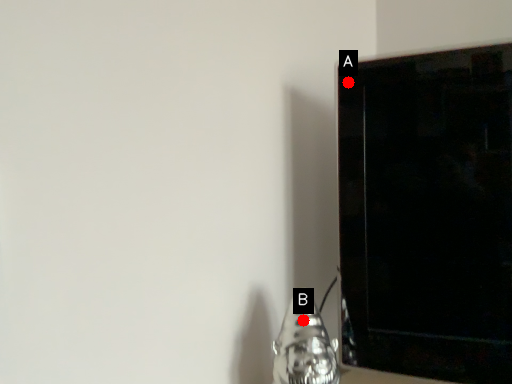
Question: Two points are circled on the image, labeled by A and B beside each circle. Which point is closer to the camera?

Choices:
 (A) A is closer
 (B) B is closer

Answer: (B)